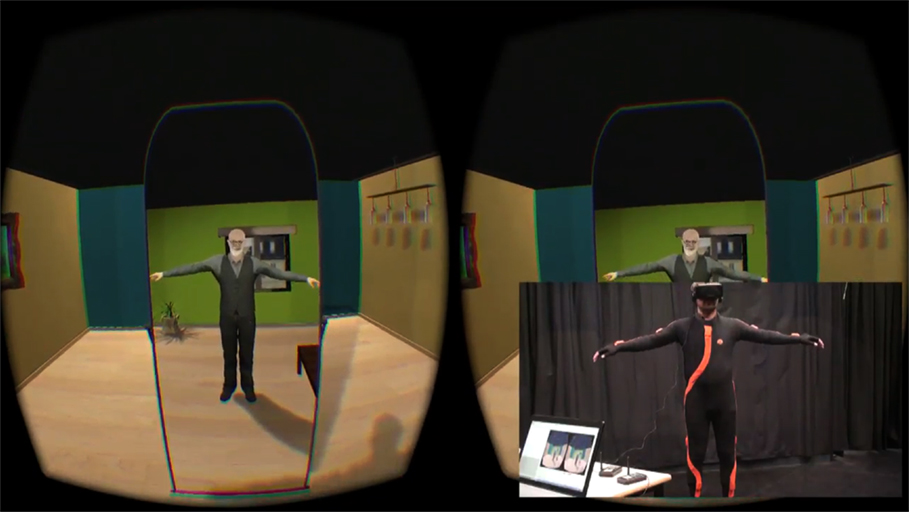
I want to click on black curtain, so click(773, 400).